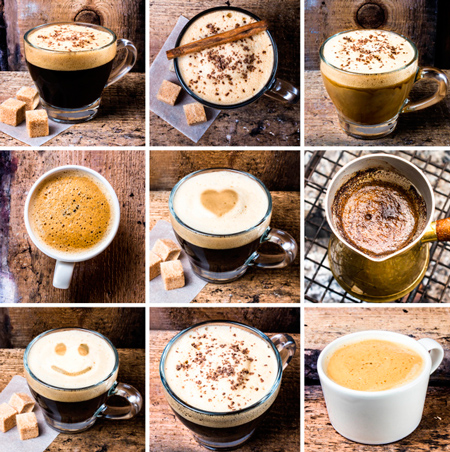
The height and width of the screenshot is (452, 450). I want to click on coffee in clear mug, so click(89, 70), click(360, 93), click(92, 405), click(220, 424), click(230, 250).